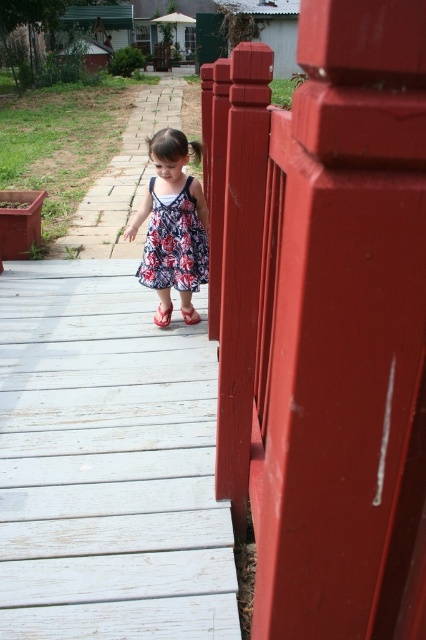
Question: Is floral dress at center positioned before brick paved path at center?

Choices:
 (A) no
 (B) yes

Answer: (B)

Question: Based on their relative distances, which object is nearer to the floral dress at center?

Choices:
 (A) floral fabric dress at center
 (B) brick paved path at center

Answer: (A)

Question: Is floral dress at center bigger than floral fabric dress at center?

Choices:
 (A) yes
 (B) no

Answer: (A)

Question: Which of the following is the farthest from the observer?

Choices:
 (A) (8, 486)
 (B) (166, 298)

Answer: (B)

Question: Which of these objects is positioned farthest from the white wood path at center?

Choices:
 (A) smooth glossy wood at right
 (B) floral fabric dress at center
 (C) brick paved path at center
 (D) floral dress at center

Answer: (C)

Question: Does floral dress at center lie in front of matte pink sandal at center?

Choices:
 (A) yes
 (B) no

Answer: (A)